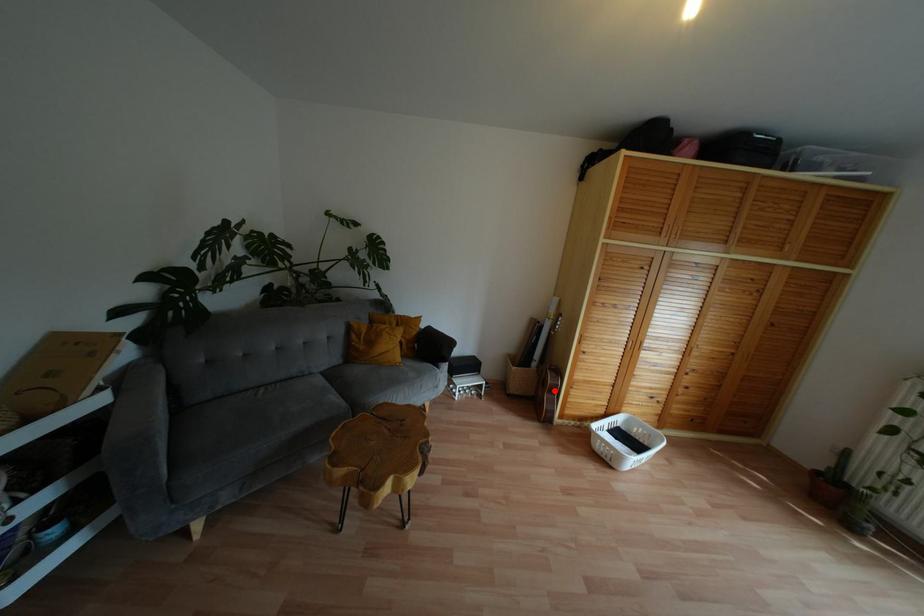
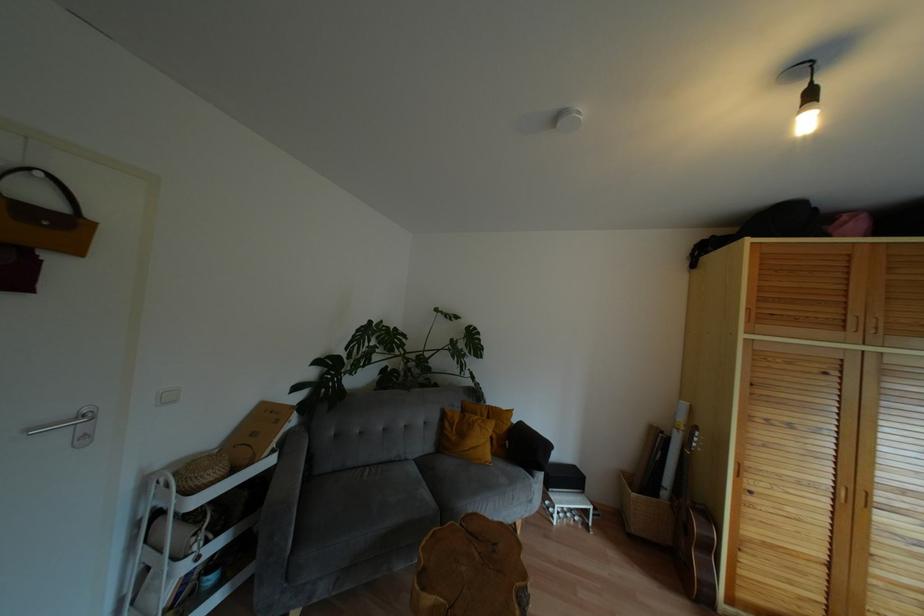
Where in the second image is the point corresponding to the highlighted location from the first image?

(710, 548)